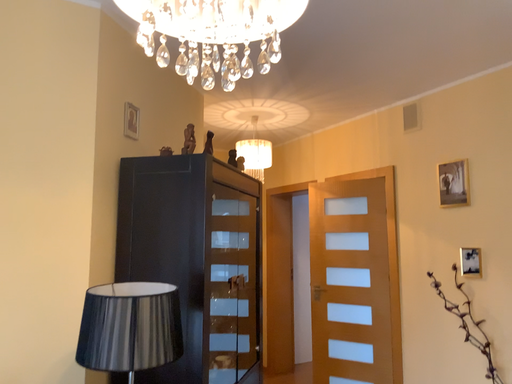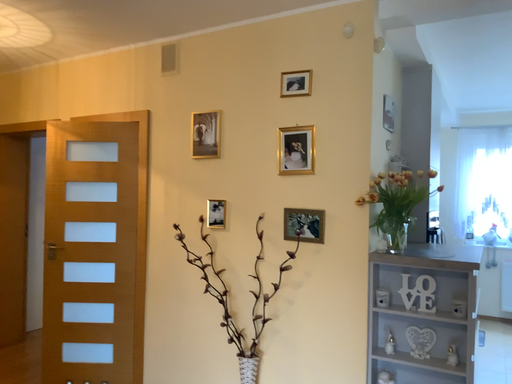
Question: Which way did the camera rotate in the video?

Choices:
 (A) rotated left
 (B) rotated right

Answer: (B)